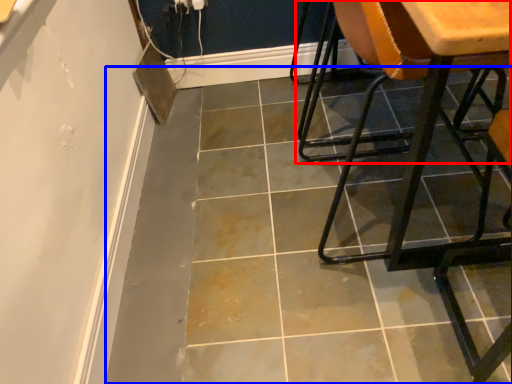
Question: Which object is further to the camera taking this photo, chair (highlighted by a red box) or concrete (highlighted by a blue box)?

Choices:
 (A) chair
 (B) concrete

Answer: (A)